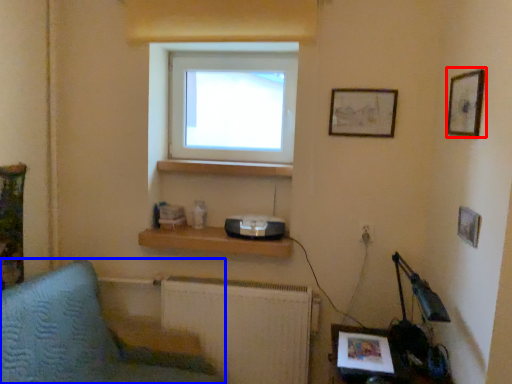
Question: Among these objects, which one is farthest to the camera, picture frame (highlighted by a red box) or furniture (highlighted by a blue box)?

Choices:
 (A) picture frame
 (B) furniture

Answer: (A)